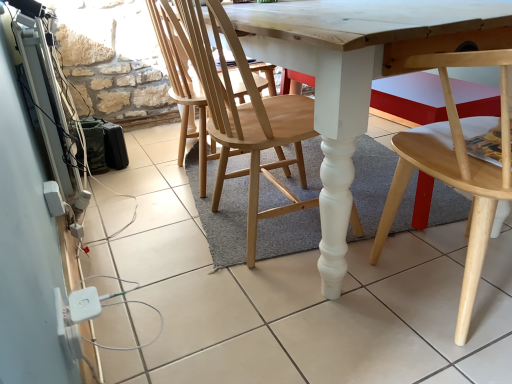
Identify the location of free area in between light wood chair at lower right, which is the second chair in left-to-right order, and natural wood chair at center, marked as the 1th chair in a left-to-right arrangement. (359, 276).